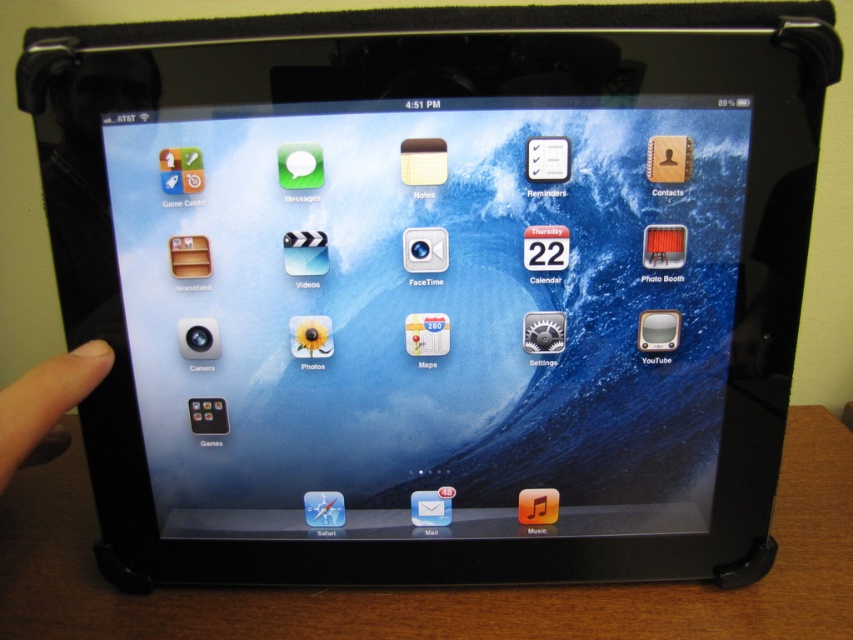
Can you confirm if brown wooden table at bottom is bigger than skinsmoothhand at left?

Yes.

Measure the distance between brown wooden table at bottom and skinsmoothhand at left.

brown wooden table at bottom and skinsmoothhand at left are 10.19 inches apart from each other.

Who is more distant from viewer, [785,477] or [9,444]?

The point [785,477] is more distant.

Locate an element on the screen. This screenshot has width=853, height=640. brown wooden table at bottom is located at coordinates (437, 588).